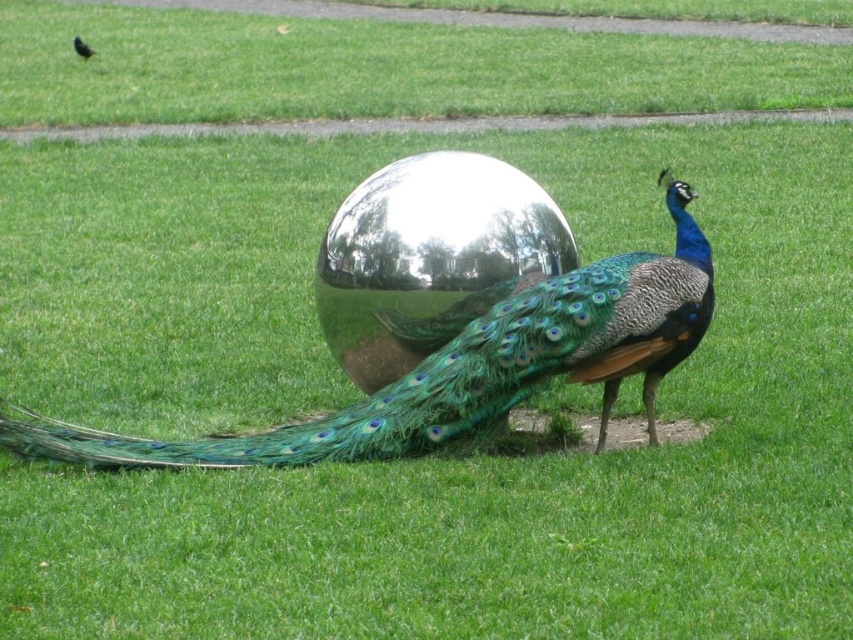
Is shiny metallic peacock at center positioned before matte black peacock at center?

That is True.

Based on the photo, between shiny metallic peacock at center and matte black peacock at center, which one is positioned lower?

shiny metallic peacock at center is lower down.

Is point (689, 256) positioned behind point (83, 52)?

No, it is in front of (83, 52).

You are a GUI agent. You are given a task and a screenshot of the screen. Output one action in this format:
    pyautogui.click(x=<x>, y=<y>)
    Task: Click on the shiny metallic peacock at center
    
    Given the screenshot: What is the action you would take?
    pyautogui.click(x=463, y=368)

Who is higher up, shiny metallic peacock at center or shiny metallic sphere at center?

shiny metallic sphere at center

Does shiny metallic peacock at center appear on the right side of shiny metallic sphere at center?

No, shiny metallic peacock at center is not to the right of shiny metallic sphere at center.

Which is behind, point (668, 298) or point (445, 186)?

Positioned behind is point (445, 186).

The width and height of the screenshot is (853, 640). What are the coordinates of `shiny metallic peacock at center` in the screenshot? It's located at (463, 368).

Is shiny metallic sphere at center shorter than matte black peacock at center?

In fact, shiny metallic sphere at center may be taller than matte black peacock at center.

Can you confirm if shiny metallic sphere at center is smaller than matte black peacock at center?

Actually, shiny metallic sphere at center might be larger than matte black peacock at center.

Is point (439, 266) positioned behind point (90, 51)?

That is False.

Identify the location of shiny metallic sphere at center. (x=428, y=257).